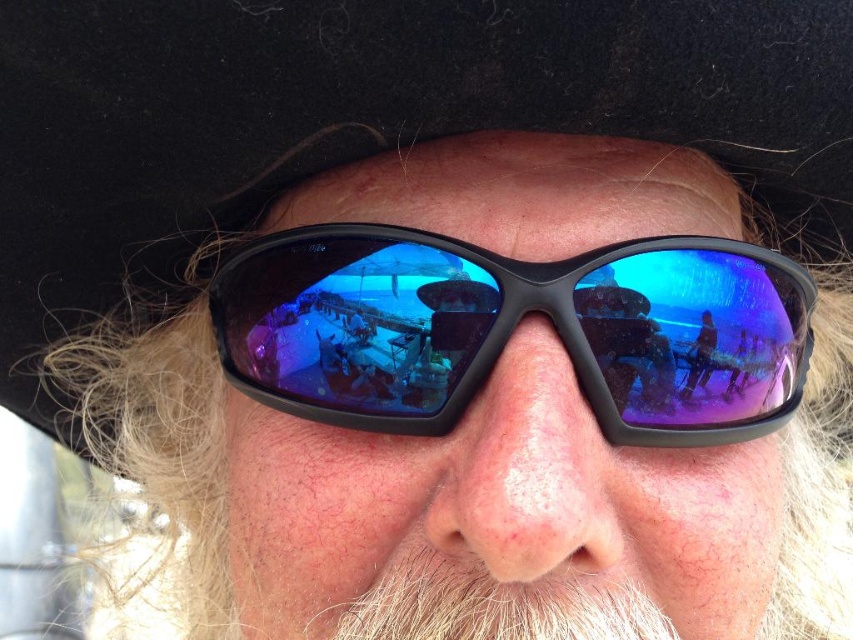
Between point (432, 64) and point (231, 376), which one is positioned behind?

The point (231, 376) is more distant.

Which is behind, point (26, 20) or point (282, 362)?

Point (282, 362)

I want to click on black felt cowboy hat at upper center, so click(367, 122).